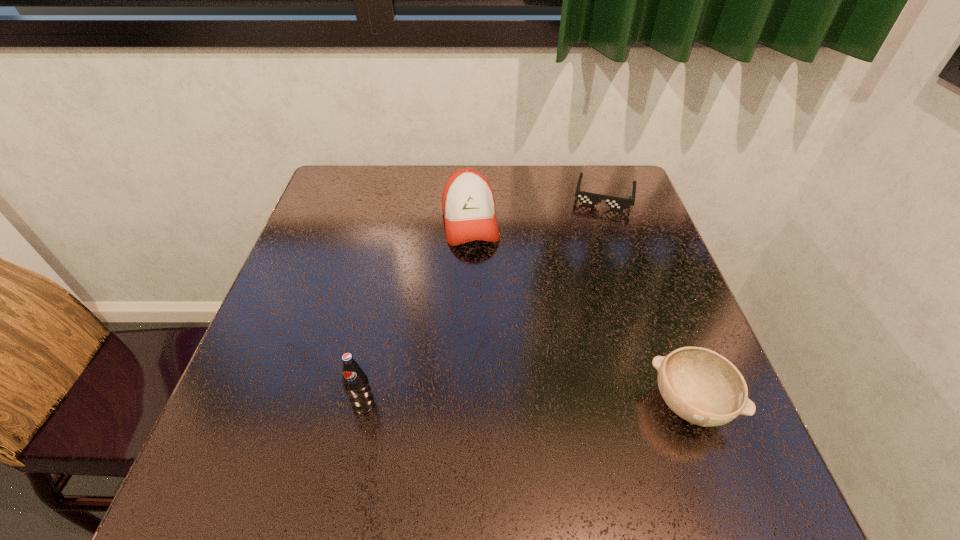
Identify the location of the leftmost object. The height and width of the screenshot is (540, 960). (355, 381).

Locate an element on the screen. The width and height of the screenshot is (960, 540). the third tallest object is located at coordinates (701, 386).

Where is `the third object from right to left`? The image size is (960, 540). the third object from right to left is located at coordinates (468, 204).

Locate an element on the screen. Image resolution: width=960 pixels, height=540 pixels. the third shortest object is located at coordinates tap(468, 204).

Identify the location of sunglasses. This screenshot has height=540, width=960. (590, 199).

What are the coordinates of `free space located 0.050m on the front label of the pop` in the screenshot? It's located at (355, 442).

I want to click on free space located 0.120m on the left of the second shortest object, so click(x=582, y=404).

At what (x,y) coordinates should I click in order to perform the action: click on vacant space positioned 0.100m on the front-facing side of the third object from right to left. Please return your answer as a coordinate pair (x, y). This screenshot has height=540, width=960. Looking at the image, I should click on point(479,281).

Where is `vacant space located 0.360m on the front-facing side of the third object from right to left`? vacant space located 0.360m on the front-facing side of the third object from right to left is located at coordinates (497, 379).

You are a GUI agent. You are given a task and a screenshot of the screen. Output one action in this format:
    pyautogui.click(x=<x>, y=<y>)
    Task: Click on the vacant region located on the front-facing side of the third object from right to left
    The image size is (960, 540).
    Given the screenshot: What is the action you would take?
    pyautogui.click(x=495, y=370)